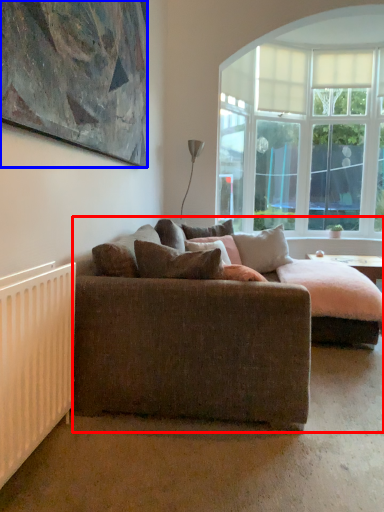
Question: Which object appears closest to the camera in this image, studio couch (highlighted by a red box) or picture frame (highlighted by a blue box)?

Choices:
 (A) studio couch
 (B) picture frame

Answer: (B)